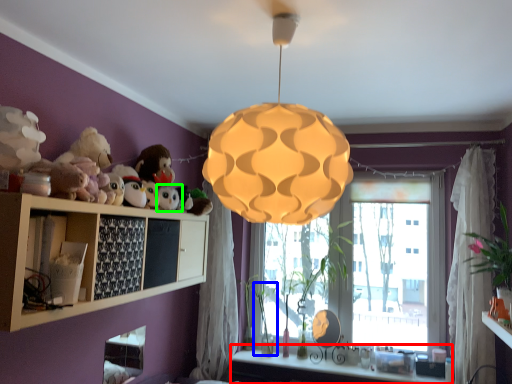
Question: Estimate the real-world distances between objects in this image. Which object is farther from vanity (highlighted by a red box), plant (highlighted by a blue box) or toy (highlighted by a green box)?

Choices:
 (A) plant
 (B) toy

Answer: (B)